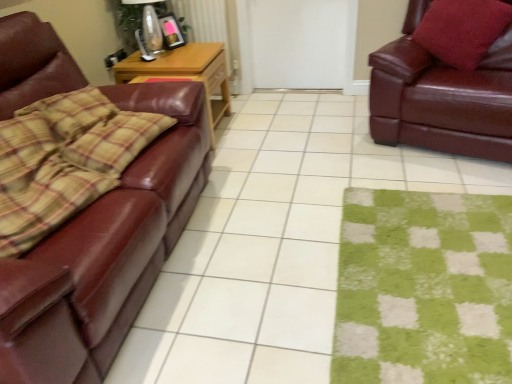
This screenshot has width=512, height=384. Find the location of `woodenobject at left`. woodenobject at left is located at coordinates coord(185,74).

Measure the distance between matte brown leather couch at left and camera.

matte brown leather couch at left and camera are 4.65 feet apart.

At what (x,y) coordinates should I click in order to perform the action: click on velvet red pillow at upper right. Please return your answer as a coordinate pair (x, y). Image resolution: width=512 pixels, height=384 pixels. Looking at the image, I should click on (462, 30).

What is the approximate height of metallic radiator at center?

The height of metallic radiator at center is 83.86 centimeters.

Measure the distance between green fuzzy mat at lower right and camera.

The depth of green fuzzy mat at lower right is 4.41 feet.

This screenshot has height=384, width=512. What do you see at coordinates (302, 43) in the screenshot?
I see `white matte door at center` at bounding box center [302, 43].

Identify the location of woodenobject at left. This screenshot has height=384, width=512. (185, 74).

Does matte brown leather couch at left appear on the right side of shiny brown leather couch at right, acting as the 1th studio couch starting from the right?

In fact, matte brown leather couch at left is to the left of shiny brown leather couch at right, acting as the 1th studio couch starting from the right.

From the image's perspective, is matte brown leather couch at left on top of shiny brown leather couch at right, positioned as the 2th studio couch in left-to-right order?

No, from the image's perspective, matte brown leather couch at left is not above shiny brown leather couch at right, positioned as the 2th studio couch in left-to-right order.

Is matte brown leather couch at left turned away from shiny brown leather couch at right, positioned as the 2th studio couch in left-to-right order?

No, shiny brown leather couch at right, positioned as the 2th studio couch in left-to-right order, is not at the back of matte brown leather couch at left.

Is point (190, 248) farther from camera compared to point (150, 2)?

No, (190, 248) is in front of (150, 2).

Considering the relative sizes of matte brown leather couch at left and matte glass lamp at upper center in the image provided, is matte brown leather couch at left taller than matte glass lamp at upper center?

In fact, matte brown leather couch at left may be shorter than matte glass lamp at upper center.

Does matte brown leather couch at left have a lesser width compared to matte glass lamp at upper center?

No, matte brown leather couch at left is not thinner than matte glass lamp at upper center.

Is matte glass lamp at upper center a part of matte brown leather couch at left?

Definitely not — matte glass lamp at upper center is not inside matte brown leather couch at left.

Is white matte door at center positioned with its back to woodenobject at left?

That's not correct — white matte door at center is not looking away from woodenobject at left.

From a real-world perspective, between white matte door at center and woodenobject at left, who is vertically lower?

In real-world perspective, woodenobject at left is lower.

Considering the relative positions of white matte door at center and woodenobject at left in the image provided, is white matte door at center behind woodenobject at left?

Yes, white matte door at center is further from the camera.

Does white matte door at center touch woodenobject at left?

No, white matte door at center is not touching woodenobject at left.

Can you tell me how much green fuzzy mat at lower right and velvet red pillow at upper right differ in facing direction?

They differ by 111 degrees in their facing directions.

Consider the image. Is green fuzzy mat at lower right at the right side of velvet red pillow at upper right?

No.

Considering the relative sizes of green fuzzy mat at lower right and velvet red pillow at upper right in the image provided, is green fuzzy mat at lower right shorter than velvet red pillow at upper right?

Yes, green fuzzy mat at lower right is shorter than velvet red pillow at upper right.

Is green fuzzy mat at lower right positioned before velvet red pillow at upper right?

Yes.

Is velvet red pillow at upper right beside white matte door at center?

velvet red pillow at upper right and white matte door at center are clearly separated.

Between velvet red pillow at upper right and white matte door at center, which one has smaller width?

white matte door at center.

Identify the location of throw pillow on the right of the white matte door at center. Image resolution: width=512 pixels, height=384 pixels. (462, 30).

Which is correct: velvet red pillow at upper right is inside white matte door at center, or outside of it?

The correct answer is: outside.

From a real-world perspective, is matte brown leather couch at left above or below woodenobject at left?

In terms of real-world spatial position, matte brown leather couch at left is below woodenobject at left.

Considering the sizes of objects matte brown leather couch at left and woodenobject at left in the image provided, who is taller, matte brown leather couch at left or woodenobject at left?

woodenobject at left is taller.

Looking at this image, from the image's perspective, is matte brown leather couch at left on top of woodenobject at left?

No, from the image's perspective, matte brown leather couch at left is not on top of woodenobject at left.

Consider the image. What's the angular difference between matte brown leather couch at left and woodenobject at left's facing directions?

They differ by 1.53 degrees in their facing directions.

Between velvet red pillow at upper right and shiny brown leather couch at right, acting as the 1th studio couch starting from the right, which one has smaller width?

→ velvet red pillow at upper right.

Is the surface of velvet red pillow at upper right in direct contact with shiny brown leather couch at right, positioned as the 2th studio couch in left-to-right order?

velvet red pillow at upper right and shiny brown leather couch at right, positioned as the 2th studio couch in left-to-right order, are not in contact.

Who is more distant, velvet red pillow at upper right or shiny brown leather couch at right, positioned as the 2th studio couch in left-to-right order?

velvet red pillow at upper right is behind.

Which of these two, velvet red pillow at upper right or shiny brown leather couch at right, positioned as the 2th studio couch in left-to-right order, stands taller?

With more height is shiny brown leather couch at right, positioned as the 2th studio couch in left-to-right order.

From the image's perspective, which studio couch is the 2nd one above the matte brown leather couch at left? Please provide its 2D coordinates.

[(441, 97)]

At what (x,y) coordinates should I click in order to perform the action: click on square located on the right of matte glass lamp at upper center. Please return your answer as a coordinate pair (x, y). Image resolution: width=512 pixels, height=384 pixels. Looking at the image, I should click on (275, 243).

Which object lies nearer to the anchor point woodenobject at left, green fuzzy mat at lower right or metallic radiator at center?

Based on the image, metallic radiator at center appears to be nearer to woodenobject at left.

Consider the image. From the image, which object appears to be nearer to metallic radiator at center, woodenobject at left or matte glass lamp at upper center?

matte glass lamp at upper center is closer to metallic radiator at center.

In the scene shown: When comparing their distances from shiny brown leather couch at right, positioned as the 2th studio couch in left-to-right order, does woodenobject at left or matte glass lamp at upper center seem further?

matte glass lamp at upper center lies further to shiny brown leather couch at right, positioned as the 2th studio couch in left-to-right order, than the other object.

Looking at the image, which one is located closer to woodenobject at left, shiny brown leather couch at right, positioned as the 2th studio couch in left-to-right order, or matte glass lamp at upper center?

Among the two, matte glass lamp at upper center is located nearer to woodenobject at left.

Considering their positions, is green fuzzy mat at lower right positioned closer to shiny brown leather couch at left, marked as the 1th studio couch in a left-to-right arrangement, than velvet red pillow at upper right?

Among the two, green fuzzy mat at lower right is located nearer to shiny brown leather couch at left, marked as the 1th studio couch in a left-to-right arrangement.

Based on their spatial positions, is matte glass lamp at upper center or green fuzzy mat at lower right further from white matte door at center?

Among the two, green fuzzy mat at lower right is located further to white matte door at center.

Looking at the image, which one is located closer to white matte door at center, green fuzzy mat at lower right or matte brown leather couch at left?

matte brown leather couch at left is positioned closer to the anchor white matte door at center.

Considering their positions, is white matte door at center positioned further to matte brown leather couch at left than green fuzzy mat at lower right?

white matte door at center is further to matte brown leather couch at left.

This screenshot has width=512, height=384. What are the coordinates of `table located between matte brown leather couch at left and metallic radiator at center in the depth direction` in the screenshot? It's located at (185, 74).

This screenshot has height=384, width=512. I want to click on lamp between green fuzzy mat at lower right and metallic radiator at center from front to back, so click(146, 25).

This screenshot has height=384, width=512. Identify the location of lamp between shiny brown leather couch at left, marked as the 1th studio couch in a left-to-right arrangement, and woodenobject at left, along the z-axis. (146, 25).

Find the location of `table situated between matte glass lamp at upper center and velvet red pillow at upper right from left to right`. table situated between matte glass lamp at upper center and velvet red pillow at upper right from left to right is located at coordinates (185, 74).